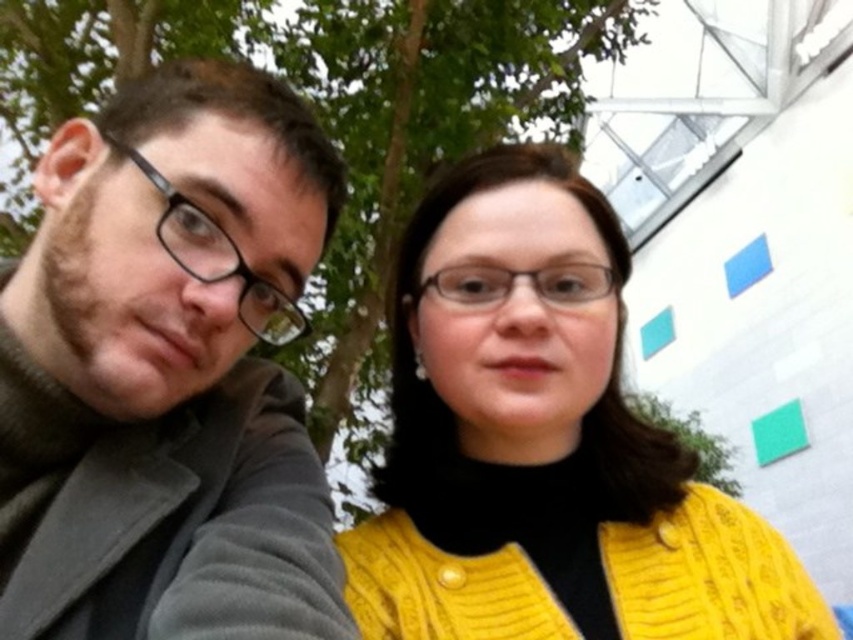
You are a fashion designer observing two outfits in the image. The matte black jacket at left and the yellow knitted sweater at center are part of the outfits. Which clothing item is covering part of the other?

The matte black jacket at left is positioned over the yellow knitted sweater at center, so it is covering part of it.

Looking at this image, you are a photographer adjusting your camera settings. You notice two points in the frame at coordinates point (16, 410) and point (219, 240). Which point is closer to the camera?

Point (219, 240) is closer to the camera because it is less further than point (16, 410) according to the description.

You are a photographer trying to capture a closeup of the transparent plastic glasses at center without including the matte black jacket at left in the frame. Given their sizes, is this possible?

The matte black jacket at left is bigger than the transparent plastic glasses at center, so it might be challenging to frame the glasses without including the jacket, especially if they are positioned closely together.